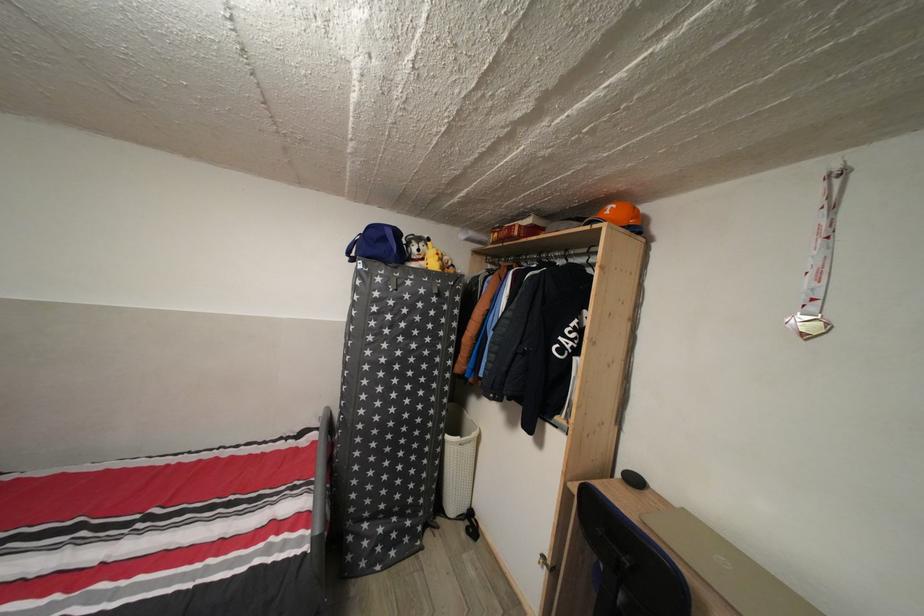
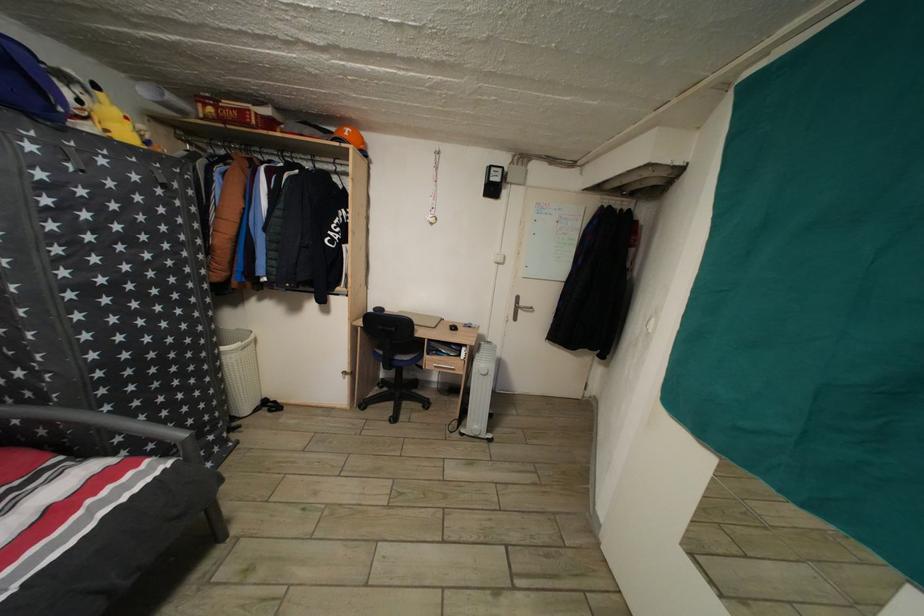
In the second image, find the point that corresponds to the point at 614,219 in the first image.

(354, 140)